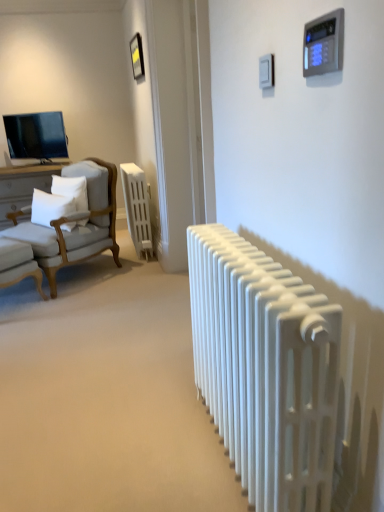
What do you see at coordinates (137, 56) in the screenshot? The height and width of the screenshot is (512, 384). I see `metallic gold picture frame at upper center` at bounding box center [137, 56].

How much space does white soft pillow at left, which ranks as the 2th pillow in right-to-left order, occupy vertically?

white soft pillow at left, which ranks as the 2th pillow in right-to-left order, is 13.71 inches tall.

What is the approximate width of white soft pillow at left, which ranks as the 2th pillow in right-to-left order?

8.90 inches.

The width and height of the screenshot is (384, 512). Describe the element at coordinates (36, 136) in the screenshot. I see `matte black tv at upper left` at that location.

Measure the distance between point (241,331) and camera.

Point (241,331) is 1.15 meters from camera.

Measure the distance between white fabric chair at left, the 1th chair in the bottom-to-top sequence, and camera.

The depth of white fabric chair at left, the 1th chair in the bottom-to-top sequence, is 2.89 meters.

You are a GUI agent. You are given a task and a screenshot of the screen. Output one action in this format:
    pyautogui.click(x=<x>, y=<y>)
    Task: Click on the metallic gold picture frame at upper center
    Image resolution: width=384 pixels, height=512 pixels.
    Given the screenshot: What is the action you would take?
    pyautogui.click(x=137, y=56)

Between white soft pillow at left, which ranks as the 2th pillow in right-to-left order, and metallic gold picture frame at upper center, which one has larger size?

Bigger between the two is white soft pillow at left, which ranks as the 2th pillow in right-to-left order.

Is white soft pillow at left, which ranks as the 2th pillow in right-to-left order, oriented away from metallic gold picture frame at upper center?

No, white soft pillow at left, which ranks as the 2th pillow in right-to-left order, is not facing the opposite direction of metallic gold picture frame at upper center.

From the image's perspective, is white soft pillow at left, the 1th pillow viewed from the left, under metallic gold picture frame at upper center?

Yes.

Is white soft pillow at left, the 1th pillow viewed from the left, surrounding metallic gold picture frame at upper center?

No, metallic gold picture frame at upper center is not surrounded by white soft pillow at left, the 1th pillow viewed from the left.

From the picture: In the image, is white soft pillow at left, the 2th pillow in the left-to-right sequence, positioned in front of or behind light gray fabric chair at left, positioned as the second chair in bottom-to-top order?

white soft pillow at left, the 2th pillow in the left-to-right sequence, is behind light gray fabric chair at left, positioned as the second chair in bottom-to-top order.

I want to click on the 2nd pillow behind the light gray fabric chair at left, positioned as the second chair in bottom-to-top order, so click(71, 192).

Measure the distance from white soft pillow at left, the first pillow viewed from the right, to light gray fabric chair at left, marked as the first chair in a top-to-bottom arrangement.

A distance of 16.91 centimeters exists between white soft pillow at left, the first pillow viewed from the right, and light gray fabric chair at left, marked as the first chair in a top-to-bottom arrangement.

From a real-world perspective, is white soft pillow at left, the 2th pillow in the left-to-right sequence, physically located above or below light gray fabric chair at left, positioned as the second chair in bottom-to-top order?

Clearly, from a real-world perspective, white soft pillow at left, the 2th pillow in the left-to-right sequence, is above light gray fabric chair at left, positioned as the second chair in bottom-to-top order.

What are the coordinates of `television above the white matte radiator at center, the 1th radiator when ordered from front to back (from a real-world perspective)` in the screenshot? It's located at (36, 136).

Which of these two, matte black tv at upper left or white matte radiator at center, acting as the 1th radiator starting from the bottom, stands taller?

white matte radiator at center, acting as the 1th radiator starting from the bottom, is taller.

Which object is more forward, matte black tv at upper left or white matte radiator at center, the 1th radiator when ordered from front to back?

white matte radiator at center, the 1th radiator when ordered from front to back.

From the picture: From the image's perspective, does matte black tv at upper left appear higher than white matte radiator at center, the 2th radiator in the back-to-front sequence?

Yes, from the image's perspective, matte black tv at upper left is over white matte radiator at center, the 2th radiator in the back-to-front sequence.

Which object is positioned more to the left, matte black tv at upper left or white matte radiator at center, which appears as the first radiator when viewed from the left?

Positioned to the left is matte black tv at upper left.

Is matte black tv at upper left positioned far away from white matte radiator at center, which ranks as the 2th radiator in bottom-to-top order?

Absolutely, matte black tv at upper left is distant from white matte radiator at center, which ranks as the 2th radiator in bottom-to-top order.

Considering the sizes of objects matte black tv at upper left and white matte radiator at center, which ranks as the 2th radiator in front-to-back order, in the image provided, who is bigger, matte black tv at upper left or white matte radiator at center, which ranks as the 2th radiator in front-to-back order,?

Bigger between the two is white matte radiator at center, which ranks as the 2th radiator in front-to-back order.

Considering the sizes of objects matte black tv at upper left and white matte radiator at center, which is counted as the first radiator, starting from the top, in the image provided, who is thinner, matte black tv at upper left or white matte radiator at center, which is counted as the first radiator, starting from the top,?

white matte radiator at center, which is counted as the first radiator, starting from the top.

This screenshot has width=384, height=512. I want to click on the 2nd radiator positioned above the white fabric chair at left, which is counted as the 2th chair, starting from the top (from a real-world perspective), so click(x=265, y=368).

Is white matte radiator at center, the 1th radiator when ordered from front to back, aimed at white fabric chair at left, which is counted as the 2th chair, starting from the top?

No, white matte radiator at center, the 1th radiator when ordered from front to back, is not facing towards white fabric chair at left, which is counted as the 2th chair, starting from the top.

Is white matte radiator at center, acting as the first radiator starting from the right, beside white fabric chair at left, the 1th chair in the bottom-to-top sequence?

No, white matte radiator at center, acting as the first radiator starting from the right, is not making contact with white fabric chair at left, the 1th chair in the bottom-to-top sequence.

Looking at this image, from a real-world perspective, is white matte radiator at center, the 2th radiator when ordered from top to bottom, located beneath white fabric chair at left, which is counted as the 2th chair, starting from the top?

No.

Based on the photo, are white fabric chair at left, which is counted as the 2th chair, starting from the top, and metallic gold picture frame at upper center located far from each other?

That's right, there is a large distance between white fabric chair at left, which is counted as the 2th chair, starting from the top, and metallic gold picture frame at upper center.

From a real-world perspective, relative to metallic gold picture frame at upper center, is white fabric chair at left, the 1th chair in the bottom-to-top sequence, vertically above or below?

Clearly, from a real-world perspective, white fabric chair at left, the 1th chair in the bottom-to-top sequence, is below metallic gold picture frame at upper center.

Considering the sizes of objects white fabric chair at left, the 1th chair in the bottom-to-top sequence, and metallic gold picture frame at upper center in the image provided, who is wider, white fabric chair at left, the 1th chair in the bottom-to-top sequence, or metallic gold picture frame at upper center?

white fabric chair at left, the 1th chair in the bottom-to-top sequence.

How different are the orientations of white fabric chair at left, which is counted as the 2th chair, starting from the top, and metallic gold picture frame at upper center in degrees?

white fabric chair at left, which is counted as the 2th chair, starting from the top, and metallic gold picture frame at upper center are facing 142 degrees away from each other.

Measure the distance from matte black tv at upper left to light gray fabric chair at left, positioned as the second chair in bottom-to-top order.

The distance of matte black tv at upper left from light gray fabric chair at left, positioned as the second chair in bottom-to-top order, is 1.20 meters.

Is matte black tv at upper left not inside light gray fabric chair at left, positioned as the second chair in bottom-to-top order?

Absolutely, matte black tv at upper left is external to light gray fabric chair at left, positioned as the second chair in bottom-to-top order.

Does point (26, 123) come closer to viewer compared to point (90, 257)?

No.

Is matte black tv at upper left directly adjacent to light gray fabric chair at left, positioned as the second chair in bottom-to-top order?

No, matte black tv at upper left is not in contact with light gray fabric chair at left, positioned as the second chair in bottom-to-top order.

Locate an element on the screen. This screenshot has width=384, height=512. pillow that is the 2nd object located in front of the metallic gold picture frame at upper center is located at coordinates (50, 207).

From the image's perspective, count 1st chairs downward from the white soft pillow at left, the 2th pillow in the left-to-right sequence, and point to it. Please provide its 2D coordinates.

[(74, 221)]

Estimate the real-world distances between objects in this image. Which object is further from light gray fabric chair at left, marked as the first chair in a top-to-bottom arrangement, white matte radiator at center, which ranks as the 2th radiator in front-to-back order, or metallic gold picture frame at upper center?

Based on the image, metallic gold picture frame at upper center appears to be further to light gray fabric chair at left, marked as the first chair in a top-to-bottom arrangement.

Based on their spatial positions, is white matte radiator at center, which is counted as the first radiator, starting from the top, or white soft pillow at left, the 1th pillow viewed from the left, closer to white soft pillow at left, the 2th pillow in the left-to-right sequence?

The object closer to white soft pillow at left, the 2th pillow in the left-to-right sequence, is white soft pillow at left, the 1th pillow viewed from the left.

When comparing their distances from white soft pillow at left, the first pillow viewed from the right, does white matte radiator at center, the 2th radiator when ordered from top to bottom, or white soft pillow at left, which ranks as the 2th pillow in right-to-left order, seem closer?

Among the two, white soft pillow at left, which ranks as the 2th pillow in right-to-left order, is located nearer to white soft pillow at left, the first pillow viewed from the right.

Looking at the image, which one is located closer to white soft pillow at left, the first pillow viewed from the right, white fabric chair at left, the 1th chair in the bottom-to-top sequence, or white soft pillow at left, the 1th pillow viewed from the left?

white soft pillow at left, the 1th pillow viewed from the left, is closer to white soft pillow at left, the first pillow viewed from the right.

When comparing their distances from white soft pillow at left, the first pillow viewed from the right, does white soft pillow at left, the 1th pillow viewed from the left, or metallic gold picture frame at upper center seem closer?

Based on the image, white soft pillow at left, the 1th pillow viewed from the left, appears to be nearer to white soft pillow at left, the first pillow viewed from the right.

Based on their spatial positions, is white fabric chair at left, the 1th chair in the bottom-to-top sequence, or white soft pillow at left, the first pillow viewed from the right, further from metallic gold picture frame at upper center?

white fabric chair at left, the 1th chair in the bottom-to-top sequence.

Based on their spatial positions, is light gray fabric chair at left, marked as the first chair in a top-to-bottom arrangement, or matte black tv at upper left further from white soft pillow at left, the 1th pillow viewed from the left?

matte black tv at upper left lies further to white soft pillow at left, the 1th pillow viewed from the left, than the other object.

Based on their spatial positions, is metallic gold picture frame at upper center or matte black tv at upper left further from white soft pillow at left, the 2th pillow in the left-to-right sequence?

The object further to white soft pillow at left, the 2th pillow in the left-to-right sequence, is metallic gold picture frame at upper center.

Locate an element on the screen. The width and height of the screenshot is (384, 512). picture frame positioned between white matte radiator at center, the 1th radiator when ordered from front to back, and white matte radiator at center, which ranks as the 2th radiator in front-to-back order, from near to far is located at coordinates (137, 56).

I want to click on television between metallic gold picture frame at upper center and white matte radiator at center, which ranks as the 2th radiator in front-to-back order, from top to bottom, so click(36, 136).

What are the coordinates of `pillow between white soft pillow at left, which ranks as the 2th pillow in right-to-left order, and white matte radiator at center, which appears as the first radiator when viewed from the left, in the horizontal direction` in the screenshot? It's located at pyautogui.click(x=71, y=192).

You are a GUI agent. You are given a task and a screenshot of the screen. Output one action in this format:
    pyautogui.click(x=<x>, y=<y>)
    Task: Click on the picture frame between white matte radiator at center, the second radiator from the left, and matte black tv at upper left in the front-back direction
    
    Given the screenshot: What is the action you would take?
    pyautogui.click(x=137, y=56)